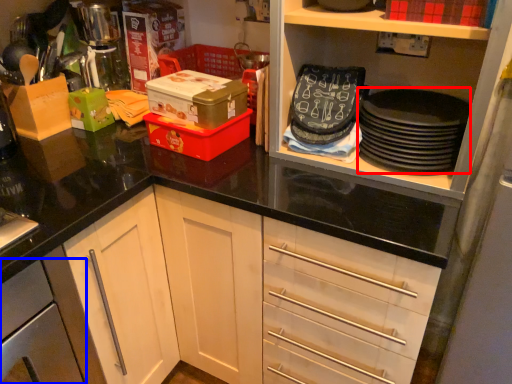
Question: Which object is further to the camera taking this photo, appliance (highlighted by a red box) or cabinetry (highlighted by a blue box)?

Choices:
 (A) appliance
 (B) cabinetry

Answer: (A)